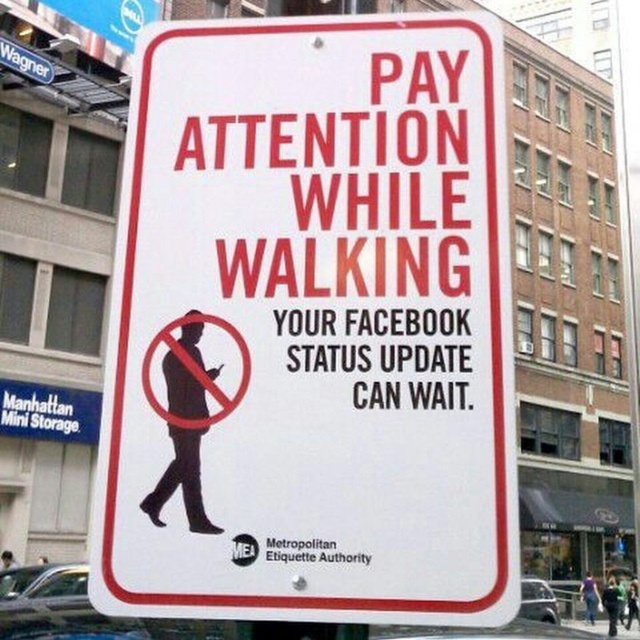
Is white paper sign at center below white plastic sign at upper left?

Yes.

Who is more distant from viewer, [124,150] or [24,74]?

Positioned behind is point [124,150].

Where is `white paper sign at center`? This screenshot has width=640, height=640. white paper sign at center is located at coordinates (310, 326).